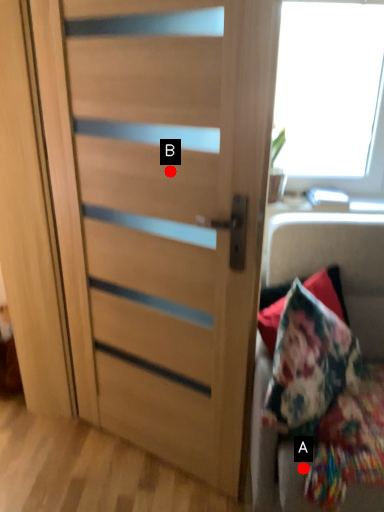
Question: Two points are circled on the image, labeled by A and B beside each circle. Which point is farther to the camera?

Choices:
 (A) A is further
 (B) B is further

Answer: (B)